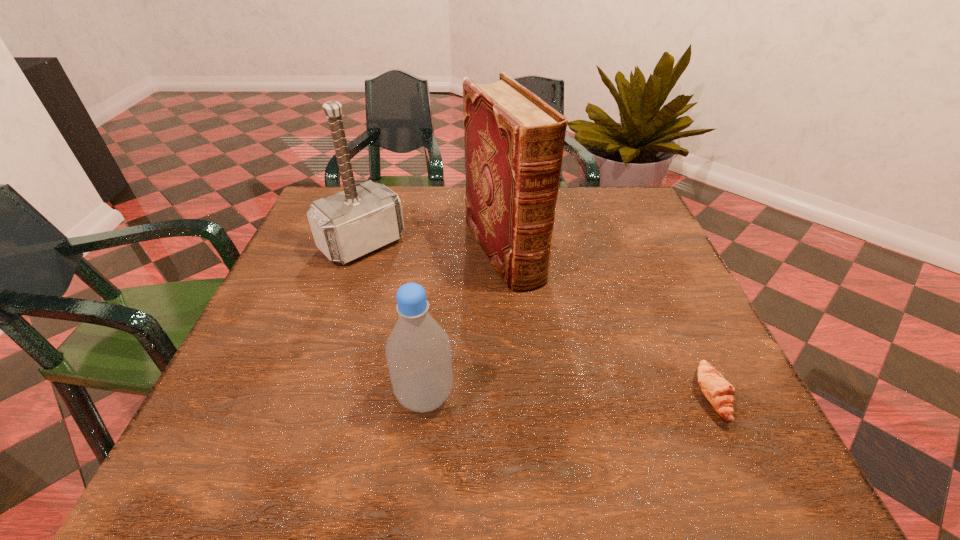
The image size is (960, 540). Identify the location of vacant area situated on the spine side of the hardback book. (532, 305).

Locate an element on the screen. free space located 0.250m on the spine side of the hardback book is located at coordinates tap(581, 375).

Locate an element on the screen. Image resolution: width=960 pixels, height=540 pixels. free region located on the spine side of the hardback book is located at coordinates (599, 402).

At what (x,y) coordinates should I click in order to perform the action: click on hammer that is at the far edge. Please return your answer as a coordinate pair (x, y). Looking at the image, I should click on (345, 226).

Locate an element on the screen. This screenshot has width=960, height=540. hardback book that is at the far edge is located at coordinates (514, 141).

Where is `bottle that is at the near edge`? bottle that is at the near edge is located at coordinates (418, 351).

Where is `pastry located in the near edge section of the desktop`? This screenshot has width=960, height=540. pastry located in the near edge section of the desktop is located at coordinates (719, 392).

This screenshot has height=540, width=960. Identify the location of object at the left edge. (345, 226).

Locate an element on the screen. object present at the right edge is located at coordinates (719, 392).

The image size is (960, 540). What are the coordinates of `object situated at the far left corner` in the screenshot? It's located at (345, 226).